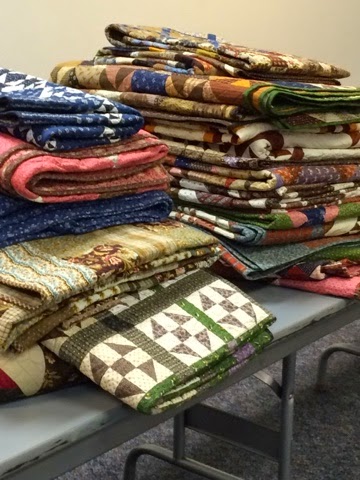
Find the location of a particular element. tabletop is located at coordinates (31, 429).